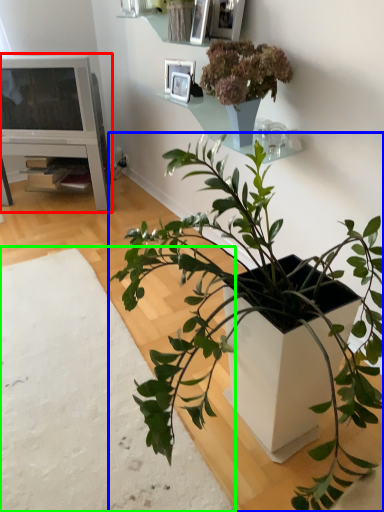
Question: Which is nearer to the entertainment center (highlighted by a red box)? houseplant (highlighted by a blue box) or plain (highlighted by a green box).

Choices:
 (A) houseplant
 (B) plain

Answer: (B)